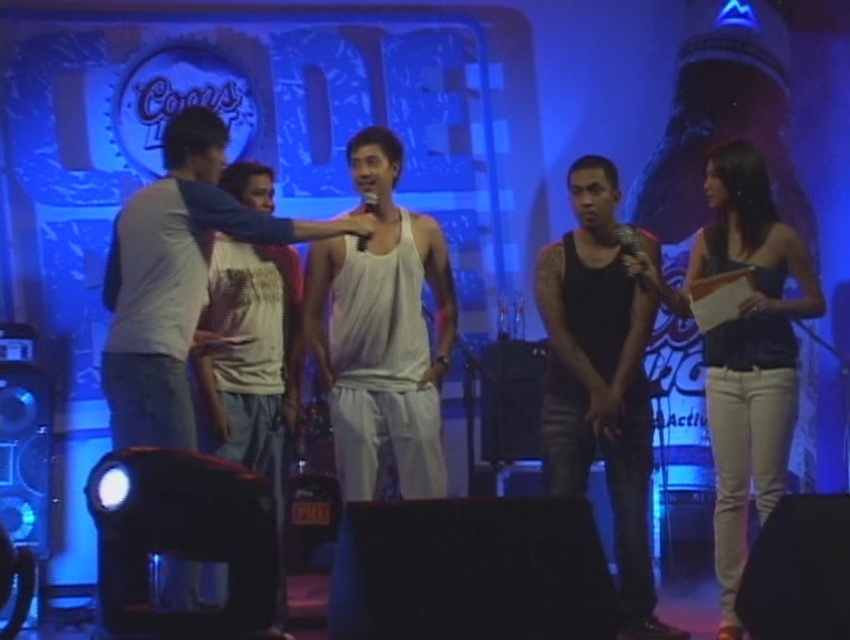
Can you confirm if white cotton t-shirt at center is positioned above black matte microphone at center?

Actually, white cotton t-shirt at center is below black matte microphone at center.

Between white cotton t-shirt at center and black matte microphone at center, which one is positioned lower?

Positioned lower is white cotton t-shirt at center.

This screenshot has height=640, width=850. Describe the element at coordinates (252, 362) in the screenshot. I see `white cotton t-shirt at center` at that location.

Identify the location of white cotton t-shirt at center. The image size is (850, 640). coord(252,362).

Is white cotton tank top at center further to camera compared to black matte microphone at center?

No, it is not.

Who is taller, white cotton tank top at center or black matte microphone at center?

white cotton tank top at center

What do you see at coordinates (176, 280) in the screenshot?
I see `white cotton tank top at center` at bounding box center [176, 280].

Locate an element on the screen. The width and height of the screenshot is (850, 640). white cotton tank top at center is located at coordinates (176, 280).

Is point (380, 164) farther from viewer compared to point (788, 380)?

Yes, point (380, 164) is farther from viewer.

Does white matte tank top at center appear under matte black tank top at right?

No, white matte tank top at center is not below matte black tank top at right.

Find the location of a particular element. white matte tank top at center is located at coordinates (382, 333).